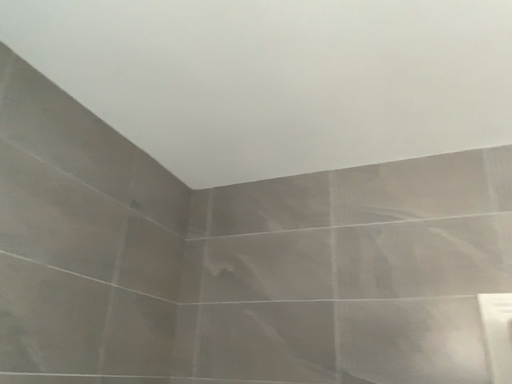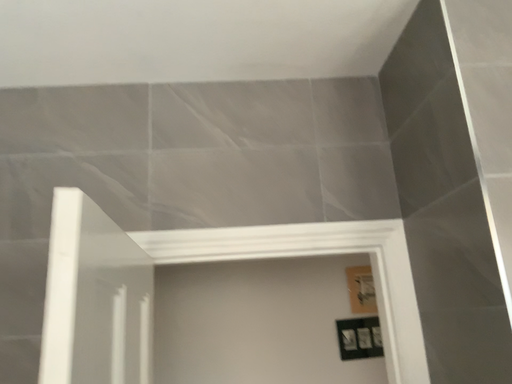
Question: How did the camera likely rotate when shooting the video?

Choices:
 (A) rotated right
 (B) rotated left

Answer: (A)